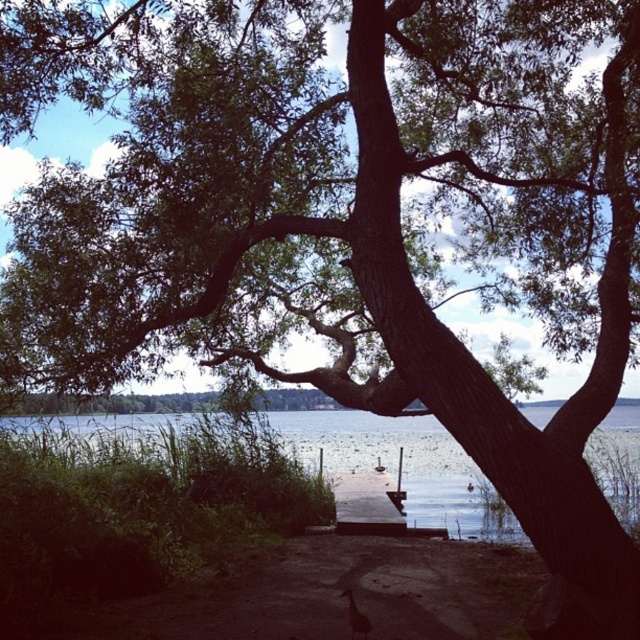
Question: Among these points, which one is farthest from the camera?

Choices:
 (A) (352, 636)
 (B) (380, 458)

Answer: (B)

Question: Considering the relative positions of clear water at center and brown feathered bird at lower center in the image provided, where is clear water at center located with respect to brown feathered bird at lower center?

Choices:
 (A) below
 (B) above

Answer: (B)

Question: Does clear water at center appear on the left side of brown feathered bird at lower center?

Choices:
 (A) yes
 (B) no

Answer: (A)

Question: Does clear water at center appear on the left side of brown feathered bird at lower center?

Choices:
 (A) no
 (B) yes

Answer: (B)

Question: Which point is farther to the camera?

Choices:
 (A) (355, 444)
 (B) (358, 624)

Answer: (A)